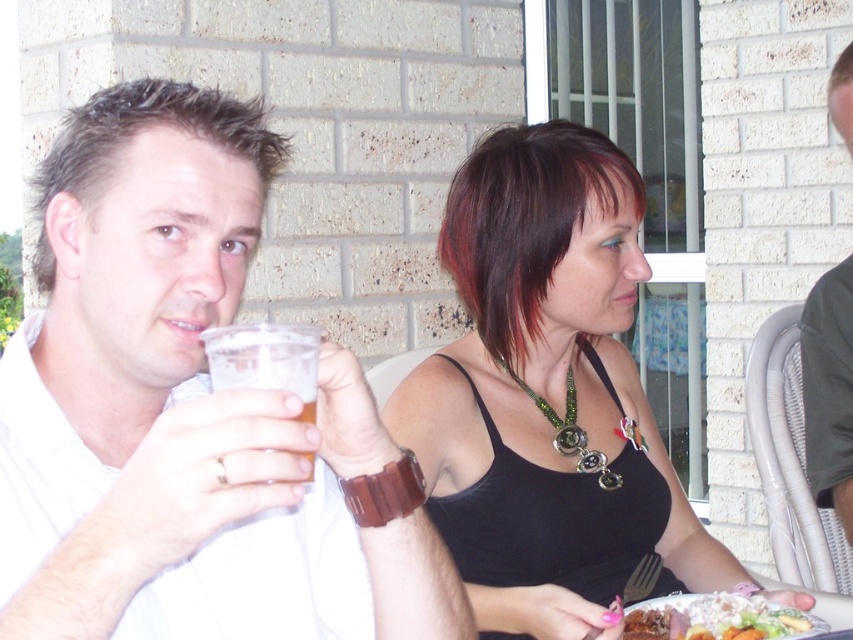
You are a photographer at a party and want to capture a photo of both the white matte shirt at upper left and the black fabric tank top at center. Since you want them both in the frame, can you confirm if they are positioned side by side horizontally?

The white matte shirt at upper left is positioned on the left side of black fabric tank top at center, so they are positioned side by side horizontally.

Looking at this image, you are a photographer standing at the point [465,259]. You want to take a photo of the man drinking his cup and the woman seated at the table. Can you fit both subjects into the frame if your camera has a 5 feet wide field of view?

Yes, because the distance between them is 4.56 feet, which is less than the 5 feet field of view, so both subjects can be captured in the frame.